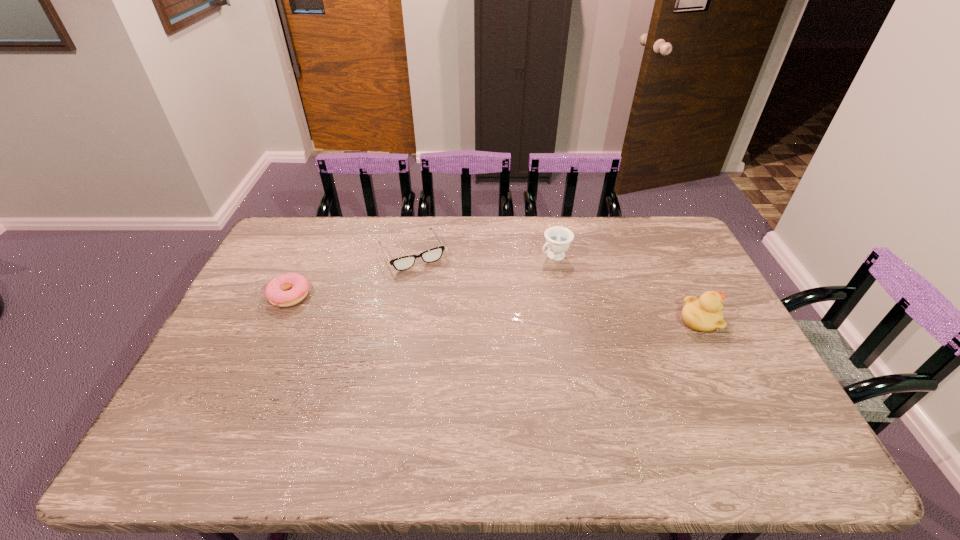
Identify which object is located as the third nearest to the rightmost object. Please provide its 2D coordinates. Your answer should be formatted as a tuple, i.e. [(x, y)], where the tuple contains the x and y coordinates of a point satisfying the conditions above.

[(275, 291)]

Locate an element on the screen. object that stands as the second closest to the third object from left to right is located at coordinates (705, 314).

This screenshot has width=960, height=540. I want to click on free space that satisfies the following two spatial constraints: 1. on the back side of the second object from left to right; 2. on the left side of the doughnut, so click(x=309, y=253).

In order to click on blank space that satisfies the following two spatial constraints: 1. on the front side of the duckling; 2. on the beak of the spectacles in this screenshot , I will do `click(400, 320)`.

This screenshot has height=540, width=960. What are the coordinates of `free space that satisfies the following two spatial constraints: 1. on the back side of the doughnut; 2. on the right side of the third object from left to right` in the screenshot? It's located at (308, 256).

Find the location of a particular element. vacant space that satisfies the following two spatial constraints: 1. on the front side of the duckling; 2. on the beak of the third object from right to left is located at coordinates (400, 320).